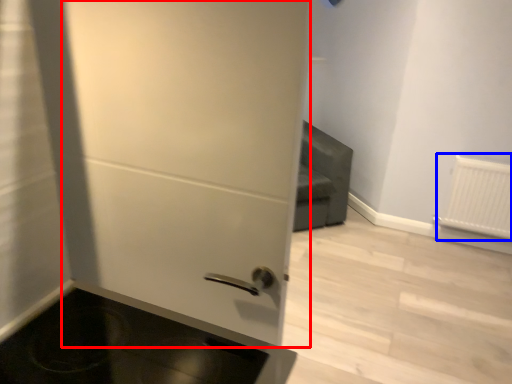
Question: Which of the following is the closest to the observer, door (highlighted by a red box) or radiator (highlighted by a blue box)?

Choices:
 (A) door
 (B) radiator

Answer: (A)